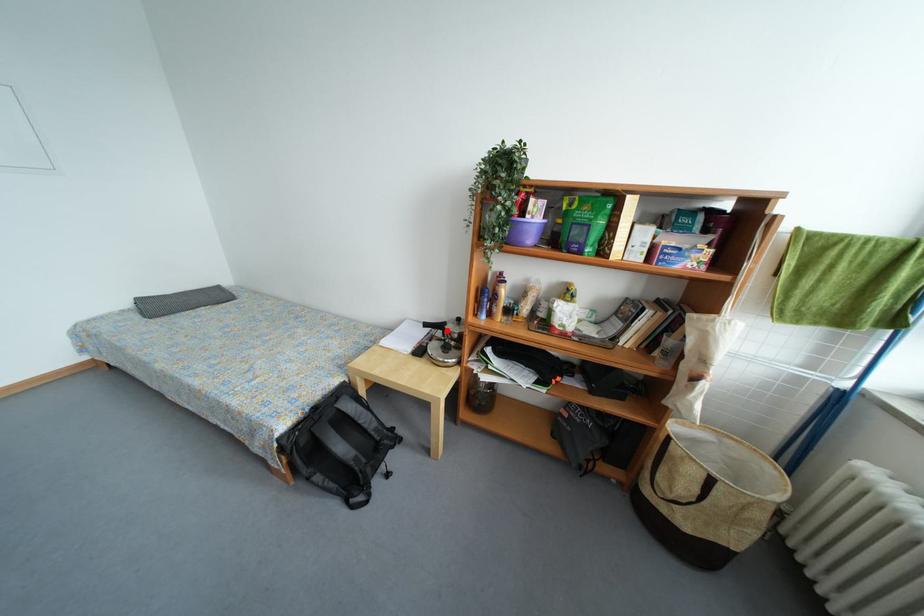
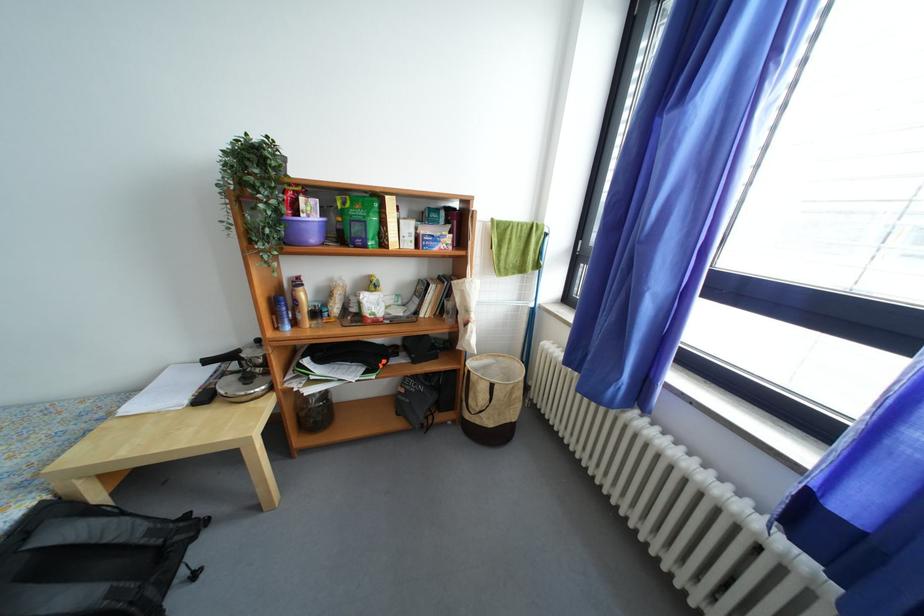
The point at the highlighted location is marked in the first image. Where is the corresponding point in the second image?

(238, 361)